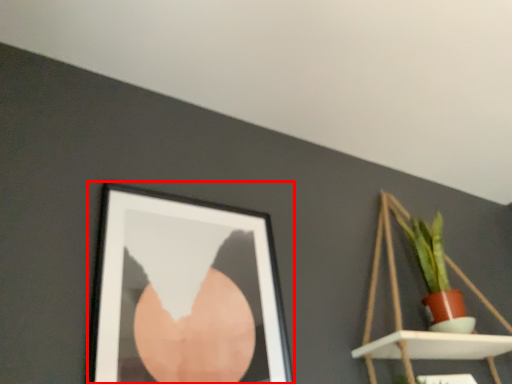
Question: Where is picture frame (annotated by the red box) located in relation to shelf in the image?

Choices:
 (A) right
 (B) left

Answer: (B)